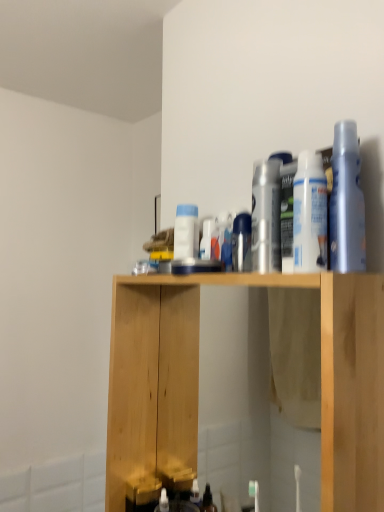
Question: From a real-world perspective, is translucent plastic spray bottle at upper right, marked as the first cleaning product in a front-to-back arrangement, above or below white matte spray can at upper right, marked as the 2th cleaning product in a front-to-back arrangement?

Choices:
 (A) above
 (B) below

Answer: (A)

Question: Considering their positions, is translucent plastic spray bottle at upper right, marked as the first cleaning product in a front-to-back arrangement, located in front of or behind white matte spray can at upper right, marked as the 2th cleaning product in a front-to-back arrangement?

Choices:
 (A) front
 (B) behind

Answer: (A)

Question: Estimate the real-world distances between objects in this image. Which object is closer to the translucent plastic spray bottle at upper right, the fourth cleaning product from the left?

Choices:
 (A) natural wood cabinet at center
 (B) white glossy spray can at center, which is counted as the first cleaning product, starting from the left
 (C) satin silver spray can at center
 (D) white matte spray can at upper right, which ranks as the third cleaning product in left-to-right order
 (E) silver metallic can at center, which is the 2th cleaning product from left to right

Answer: (D)

Question: Estimate the real-world distances between objects in this image. Which object is farther from the silver metallic can at center, which is the 2th cleaning product from left to right?

Choices:
 (A) natural wood cabinet at center
 (B) satin silver spray can at center
 (C) white matte spray can at upper right, marked as the 2th cleaning product in a front-to-back arrangement
 (D) white glossy spray can at center, which is counted as the first cleaning product, starting from the left
 (E) translucent plastic spray bottle at upper right, which is the 1th cleaning product from right to left

Answer: (A)